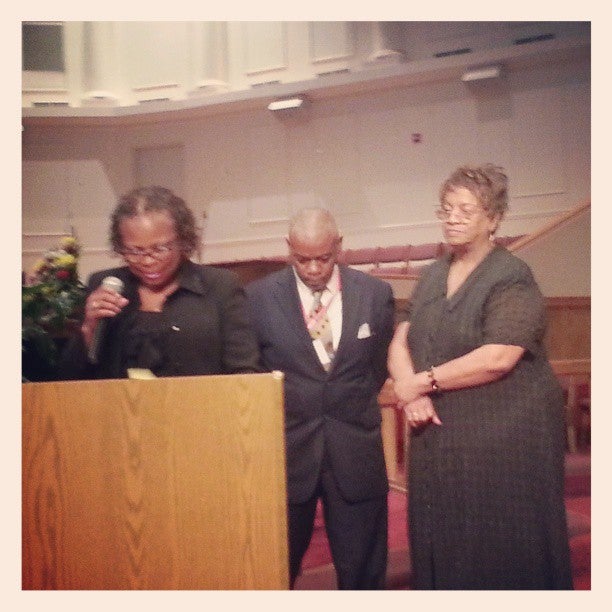
Locate an element on the screen. This screenshot has height=612, width=612. flower arrangement is located at coordinates (59, 265).